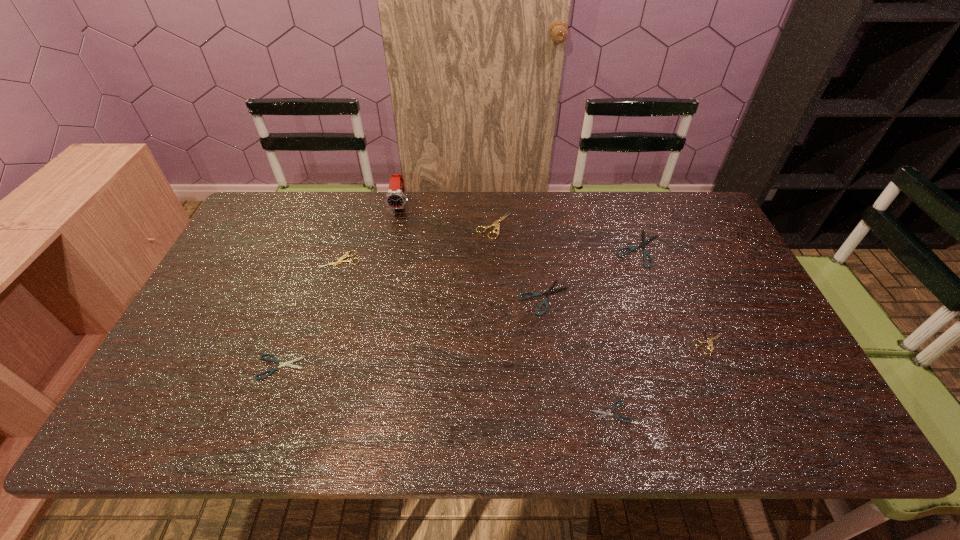
Where is `the nearest beige shears`? The width and height of the screenshot is (960, 540). the nearest beige shears is located at coordinates (709, 340).

At what (x,y) coordinates should I click in order to perform the action: click on the smallest beige shears. Please return your answer as a coordinate pair (x, y). Image resolution: width=960 pixels, height=540 pixels. Looking at the image, I should click on (709, 340).

The image size is (960, 540). Identify the location of the leftmost black shears. (275, 360).

Image resolution: width=960 pixels, height=540 pixels. Find the location of `the second nearest black shears`. the second nearest black shears is located at coordinates (275, 360).

Find the location of `the shortest shears`. the shortest shears is located at coordinates (604, 413).

I want to click on the nearest black shears, so click(604, 413).

At what (x,y) coordinates should I click in order to perform the action: click on blank space located 0.110m on the face of the sixth object from right to left. Please return your answer as a coordinate pair (x, y). Image resolution: width=960 pixels, height=540 pixels. Looking at the image, I should click on (395, 237).

This screenshot has width=960, height=540. I want to click on free space located 0.100m on the left of the second beige shears from right to left, so click(x=445, y=226).

The height and width of the screenshot is (540, 960). I want to click on free space located 0.320m on the left of the biggest black shears, so click(511, 248).

This screenshot has height=540, width=960. What are the coordinates of `vacant point located on the front of the leftmost beige shears` in the screenshot? It's located at (328, 300).